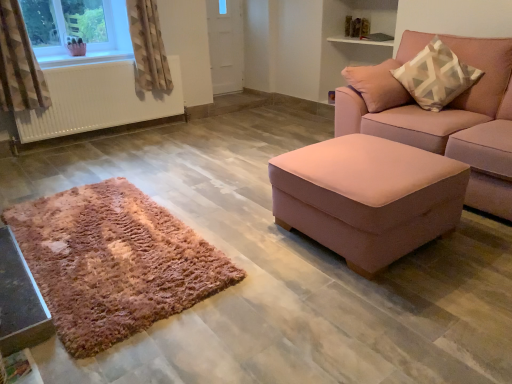
Question: Can you confirm if pink fabric couch at right is taller than white plastic window at upper left?

Choices:
 (A) no
 (B) yes

Answer: (B)

Question: Considering the relative sizes of pink fabric couch at right and white plastic window at upper left in the image provided, is pink fabric couch at right thinner than white plastic window at upper left?

Choices:
 (A) yes
 (B) no

Answer: (B)

Question: Does pink fabric couch at right come in front of white plastic window at upper left?

Choices:
 (A) yes
 (B) no

Answer: (A)

Question: From the image's perspective, is pink fabric couch at right on white plastic window at upper left?

Choices:
 (A) no
 (B) yes

Answer: (A)

Question: Are pink fabric couch at right and white plastic window at upper left making contact?

Choices:
 (A) yes
 (B) no

Answer: (B)

Question: Would you say pink fabric couch at right is a long distance from white plastic window at upper left?

Choices:
 (A) no
 (B) yes

Answer: (B)

Question: Is pink fabric ottoman at right, which ranks as the second table in left-to-right order, in front of white matte radiator at left?

Choices:
 (A) no
 (B) yes

Answer: (B)

Question: Is white matte radiator at left a part of pink fabric ottoman at right, which is the first table from right to left?

Choices:
 (A) no
 (B) yes

Answer: (A)

Question: From the image's perspective, does pink fabric ottoman at right, which ranks as the second table in left-to-right order, appear higher than white matte radiator at left?

Choices:
 (A) no
 (B) yes

Answer: (A)

Question: Is pink fabric ottoman at right, which is the first table from right to left, taller than white matte radiator at left?

Choices:
 (A) yes
 (B) no

Answer: (B)

Question: Considering the relative sizes of pink fabric ottoman at right, which ranks as the second table in left-to-right order, and white matte radiator at left in the image provided, is pink fabric ottoman at right, which ranks as the second table in left-to-right order, thinner than white matte radiator at left?

Choices:
 (A) no
 (B) yes

Answer: (A)

Question: Is pink fabric ottoman at right, which ranks as the second table in left-to-right order, not close to white matte radiator at left?

Choices:
 (A) no
 (B) yes

Answer: (B)

Question: Is white matte radiator at left at the left side of beige textured curtain at upper left, which is the 1th curtain from right to left?

Choices:
 (A) yes
 (B) no

Answer: (A)